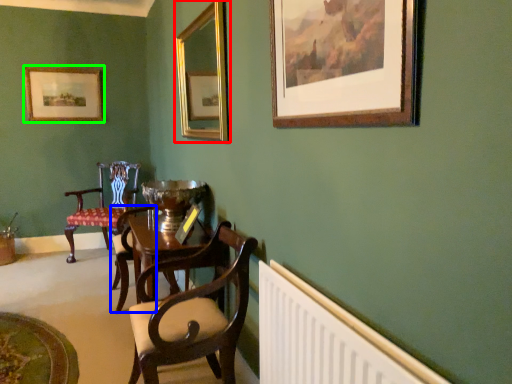
Question: Which is nearer to the picture frame (highlighted by a red box)? armchair (highlighted by a blue box) or picture frame (highlighted by a green box).

Choices:
 (A) armchair
 (B) picture frame

Answer: (B)